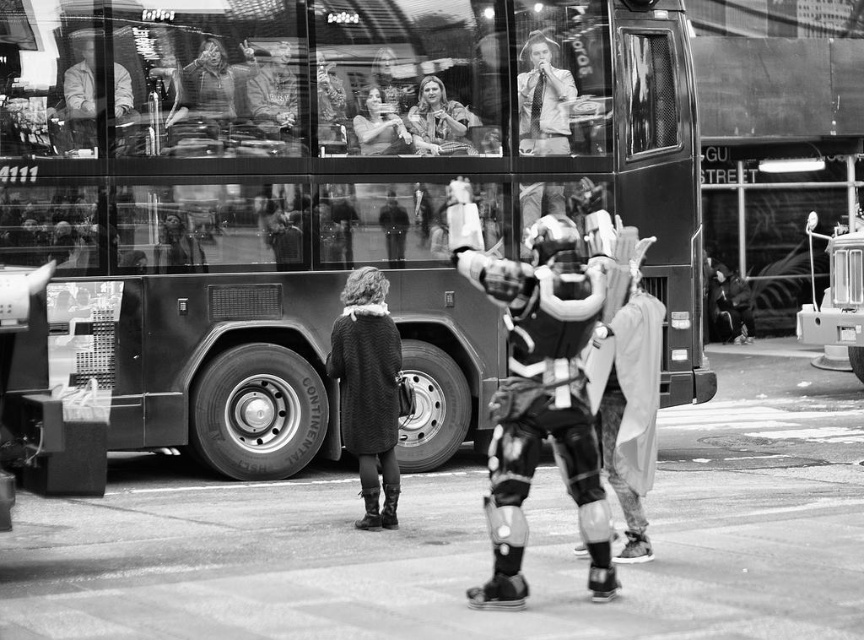
You are a photographer trying to capture both the metallic armor suit at center and the knitted wool coat at center in a single frame. Based on their widths, which one should you focus on to ensure both fit in the photo without cropping?

The metallic armor suit at center is wider than the knitted wool coat at center. To ensure both fit in the photo without cropping, focus on the metallic armor suit at center since it takes up more space.

You are a photographer standing at the center of the street. You want to take a photo of both point (98,125) and point (429,145). Which point will appear larger in your camera view?

Point (98,125) is closer to the viewer than point (429,145), so it will appear larger in the camera view.